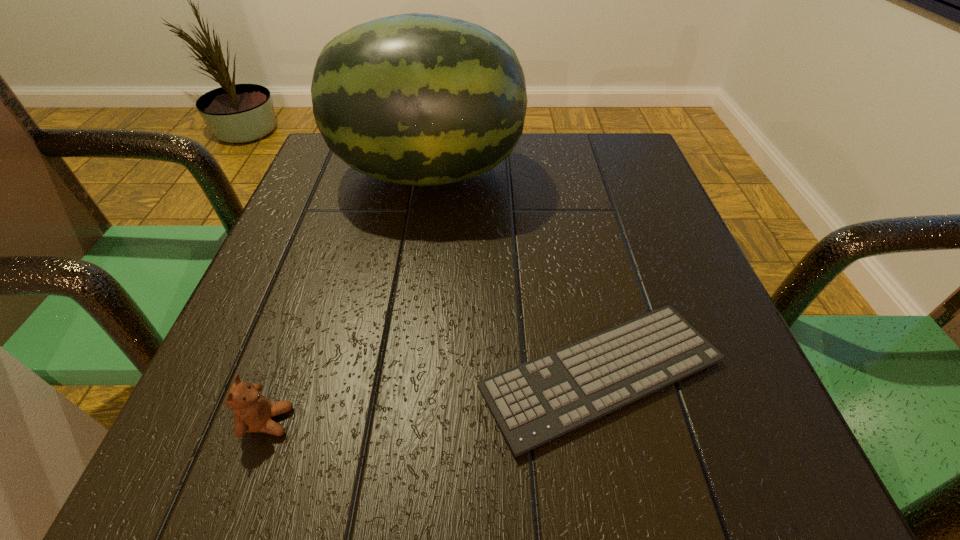
Where is `vacant point located between the second tallest object and the tallest object`? vacant point located between the second tallest object and the tallest object is located at coordinates (348, 297).

Identify the location of the second closest object to the computer keyboard. (253, 412).

You are a GUI agent. You are given a task and a screenshot of the screen. Output one action in this format:
    pyautogui.click(x=<x>, y=<y>)
    Task: Click on the object that is the second closest to the computer keyboard
    This screenshot has height=540, width=960.
    Given the screenshot: What is the action you would take?
    pyautogui.click(x=253, y=412)

The image size is (960, 540). I want to click on free point that satisfies the following two spatial constraints: 1. on the front side of the computer keyboard; 2. on the face of the teddy bear, so click(612, 421).